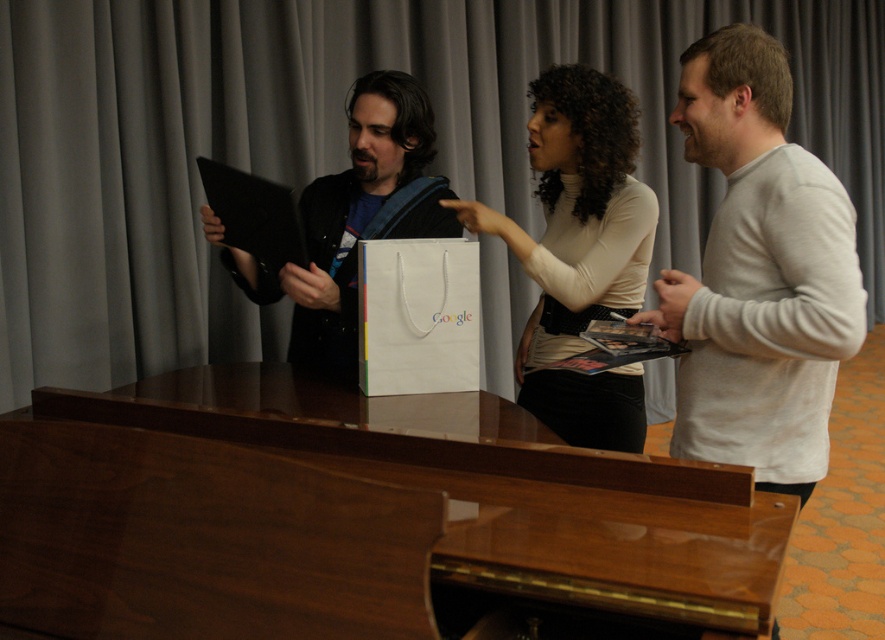
Question: Where is glossy wood piano at center located in relation to white matte bag at center in the image?

Choices:
 (A) above
 (B) below

Answer: (B)

Question: Based on their relative distances, which object is nearer to the white paper bag at center?

Choices:
 (A) matte black tablet at center
 (B) white matte bag at center

Answer: (A)

Question: Is gray fabric curtain at upper center below white cotton sweater at right?

Choices:
 (A) no
 (B) yes

Answer: (A)

Question: Estimate the real-world distances between objects in this image. Which object is farther from the white cotton sweater at right?

Choices:
 (A) glossy wood piano at center
 (B) gray fabric curtain at upper center
 (C) white matte bag at center

Answer: (B)

Question: Is gray fabric curtain at upper center thinner than matte black tablet at center?

Choices:
 (A) no
 (B) yes

Answer: (A)

Question: Which point is farther to the camera?

Choices:
 (A) (318, 241)
 (B) (412, 422)

Answer: (A)